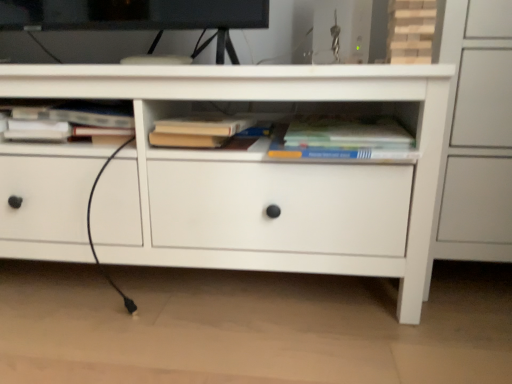
Question: Based on their positions, is white matte chest of drawers at center located to the left or right of hardcover book at center, the 1th book in the right-to-left sequence?

Choices:
 (A) left
 (B) right

Answer: (A)

Question: Is white matte chest of drawers at center taller or shorter than hardcover book at center, arranged as the third book when viewed from the left?

Choices:
 (A) tall
 (B) short

Answer: (A)

Question: Considering the real-world distances, which object is farthest from the hardcover book at upper left, which appears as the third book when viewed from the right?

Choices:
 (A) white matte chest of drawers at center
 (B) hardcover book at center, the 1th book in the right-to-left sequence
 (C) hardcover book at center, the second book viewed from the right

Answer: (B)

Question: Considering the real-world distances, which object is farthest from the hardcover book at center, which appears as the 2th book when viewed from the left?

Choices:
 (A) hardcover book at center, the 1th book in the right-to-left sequence
 (B) white matte chest of drawers at center
 (C) hardcover book at upper left, the first book positioned from the left

Answer: (C)